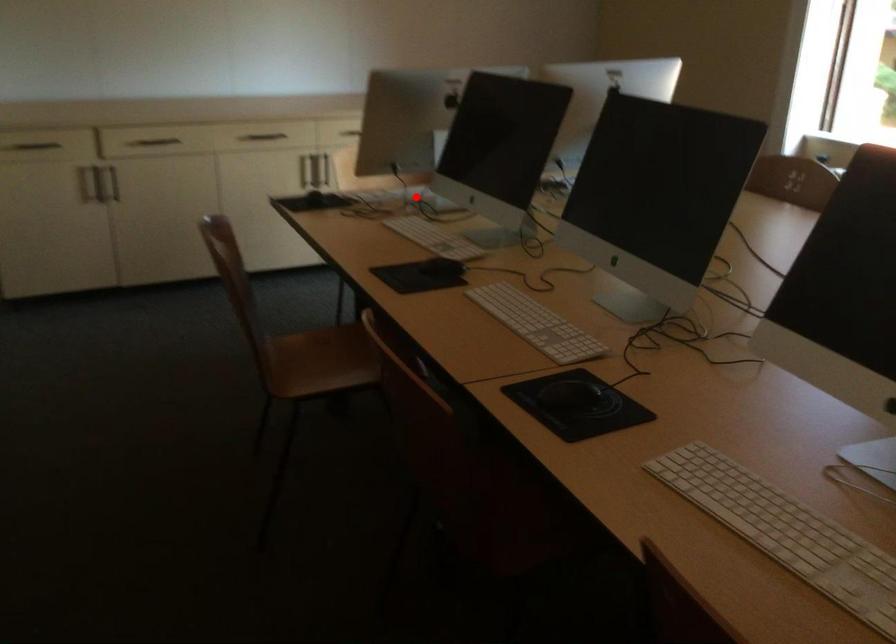
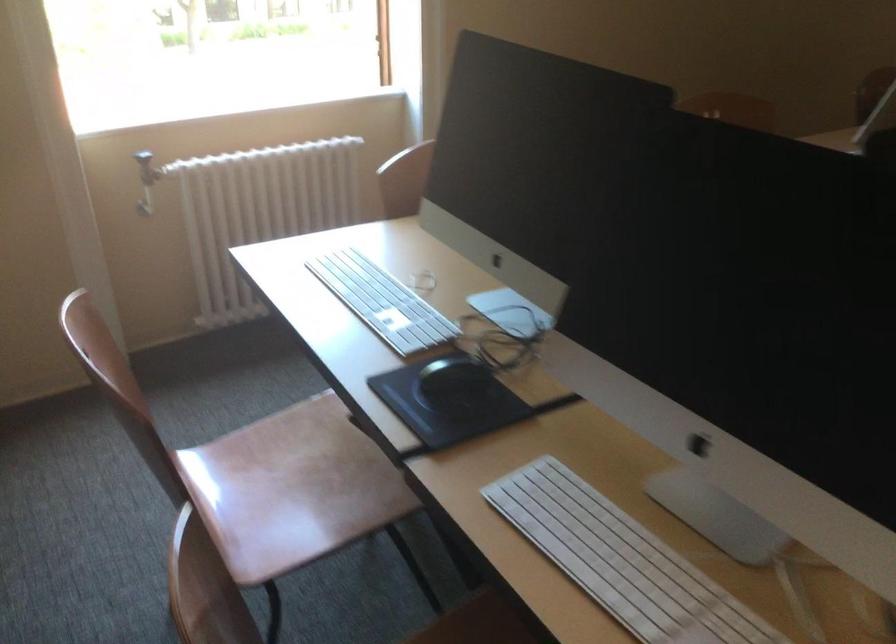
Find the pixel in the second image that matches the highlighted location in the first image.

(622, 561)